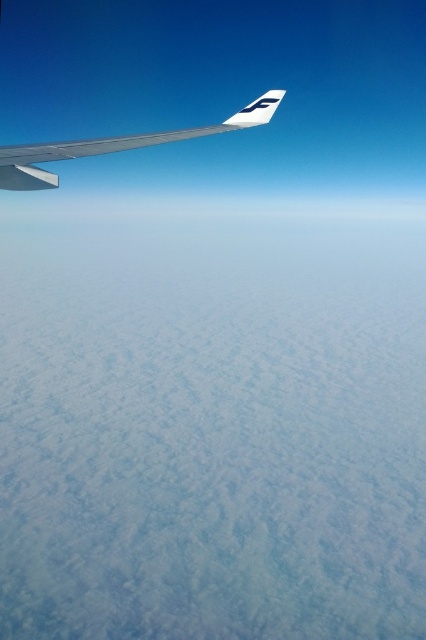
Is point (308, 208) positioned in front of point (65, 157)?

No, it is not.

Based on the photo, between white fluffy cloud at lower left and metallic silver winglet at upper left, which one has less height?

With less height is metallic silver winglet at upper left.

Between point (175, 195) and point (239, 113), which one is positioned behind?

The point (175, 195) is behind.

Locate an element on the screen. white fluffy cloud at lower left is located at coordinates (210, 208).